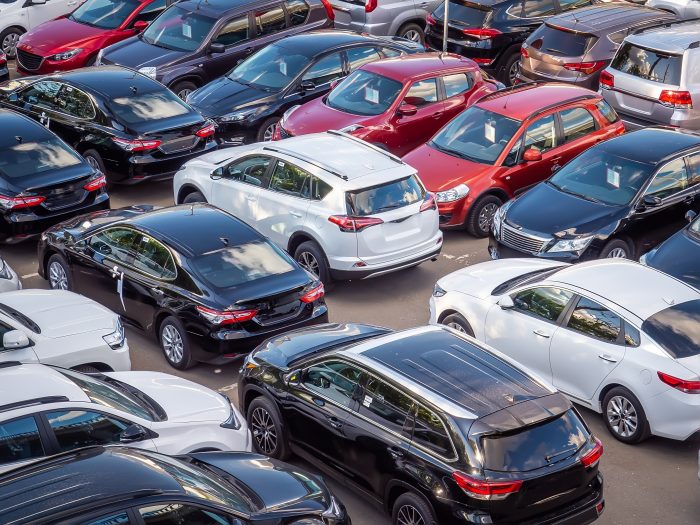
Locate an element on the screen. back windows is located at coordinates (150, 110), (38, 161), (386, 198), (259, 264), (540, 444), (679, 334), (648, 62), (560, 42), (463, 13), (357, 3).